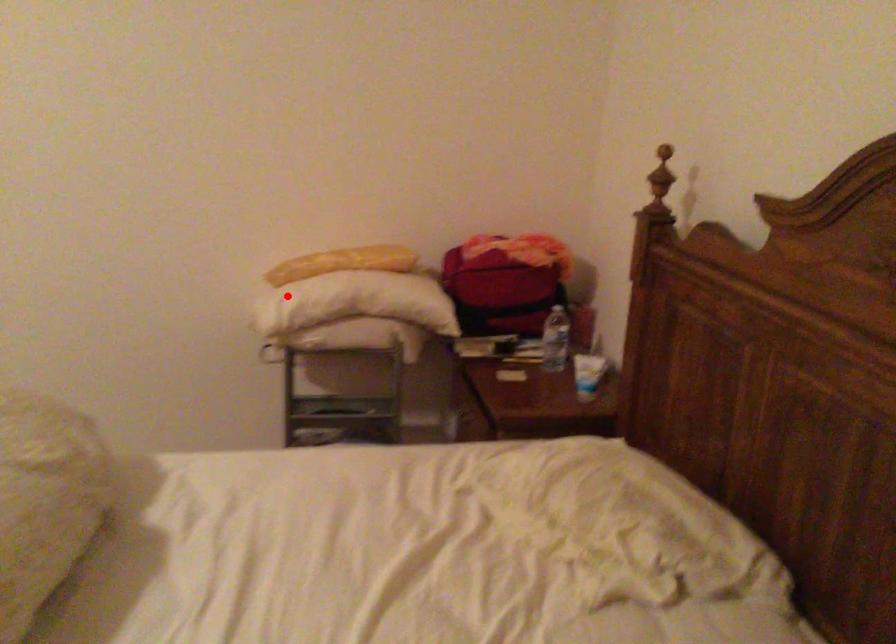
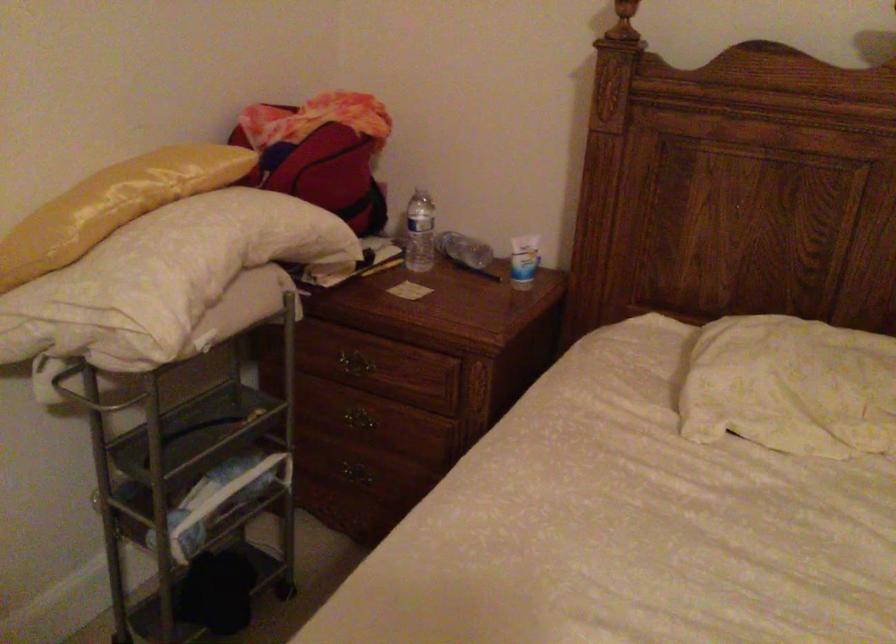
Find the pixel in the second image that matches the highlighted location in the first image.

(164, 278)